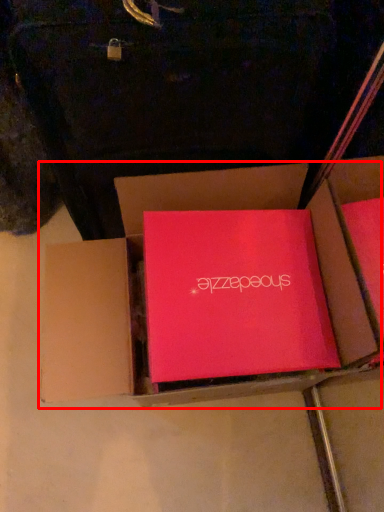
Question: From the image's perspective, where is box (annotated by the red box) located relative to box?

Choices:
 (A) below
 (B) above

Answer: (A)